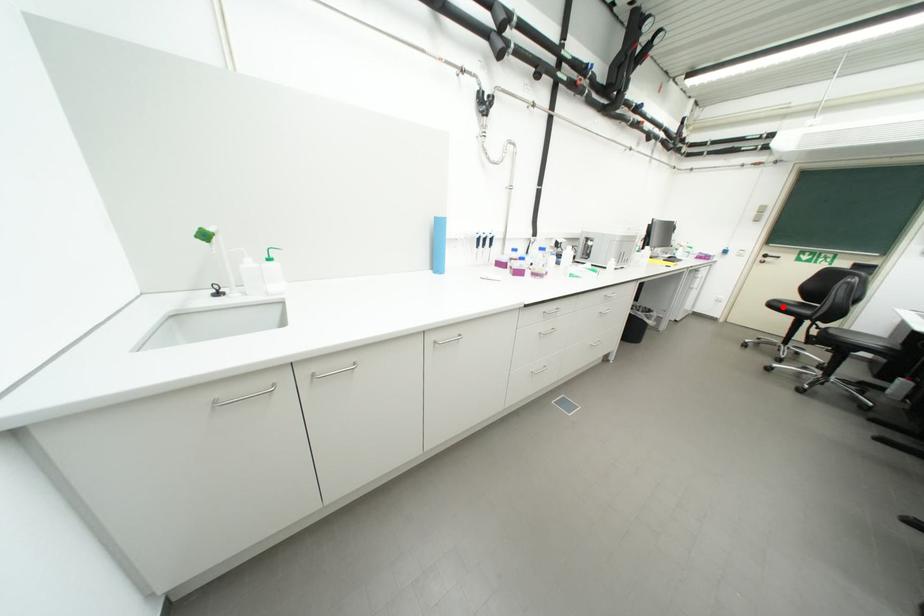
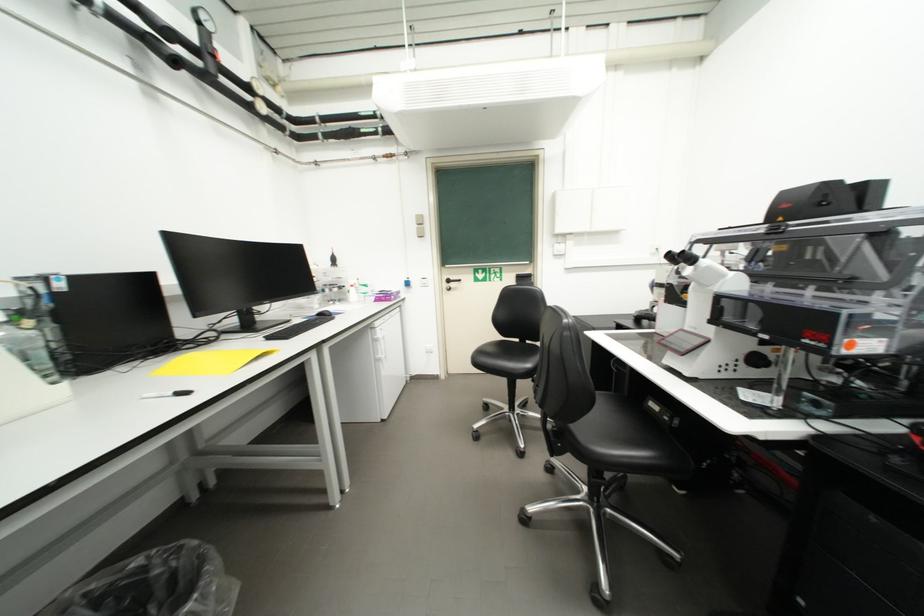
The point at the highlighted location is marked in the first image. Where is the corresponding point in the second image?

(490, 362)